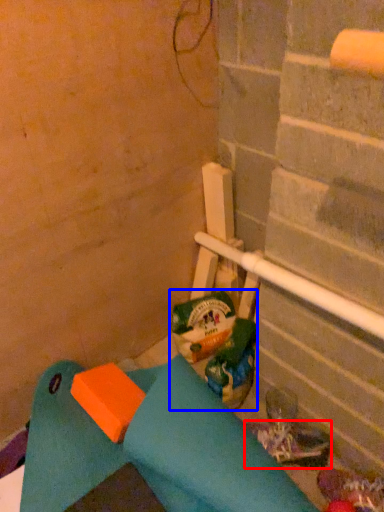
Question: Which object is further to the camera taking this photo, footwear (highlighted by a red box) or garbage (highlighted by a blue box)?

Choices:
 (A) footwear
 (B) garbage

Answer: (B)